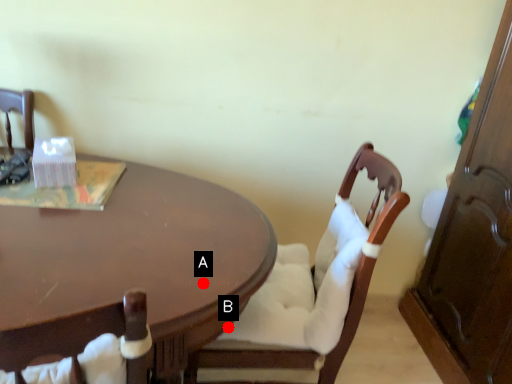
Question: Two points are circled on the image, labeled by A and B beside each circle. Which point appears closest to the camera in this image?

Choices:
 (A) A is closer
 (B) B is closer

Answer: (A)